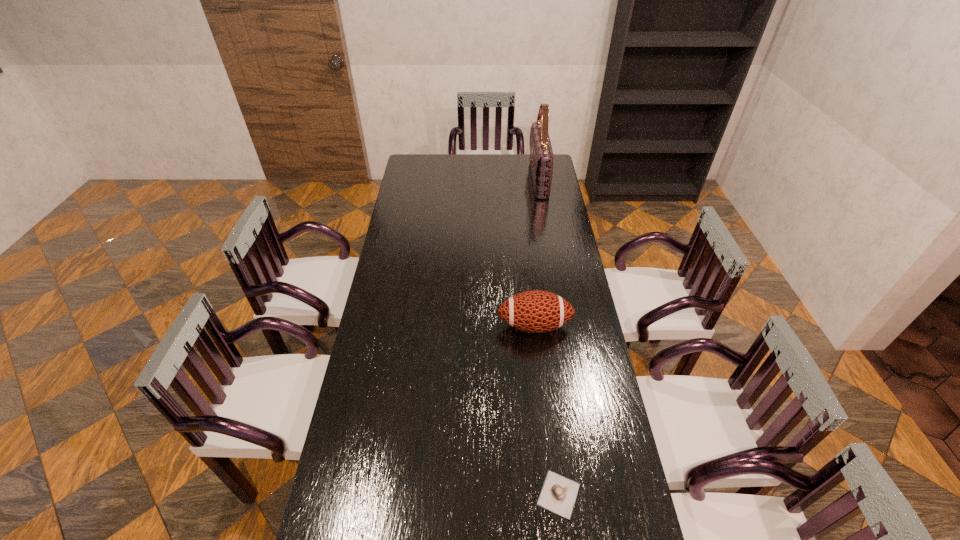
Find the location of `the tallest object`. the tallest object is located at coordinates (541, 155).

The width and height of the screenshot is (960, 540). I want to click on the farthest object, so click(541, 155).

I want to click on the second nearest object, so click(x=536, y=311).

I want to click on the second tallest object, so click(x=536, y=311).

Identify the location of garlic. The width and height of the screenshot is (960, 540). (558, 494).

The width and height of the screenshot is (960, 540). Identify the location of the nearest object. (558, 494).

Locate an element on the screen. The image size is (960, 540). free space located on the front of the handbag with the clasp is located at coordinates (483, 179).

You are a GUI agent. You are given a task and a screenshot of the screen. Output one action in this format:
    pyautogui.click(x=<x>, y=<y>)
    Task: Click on the blank space located on the front of the handbag with the clasp
    
    Given the screenshot: What is the action you would take?
    pyautogui.click(x=466, y=179)

In order to click on vacant position located on the front of the handbag with the clasp in this screenshot , I will do `click(486, 179)`.

I want to click on free spot located on the back of the second shortest object, so click(x=528, y=268).